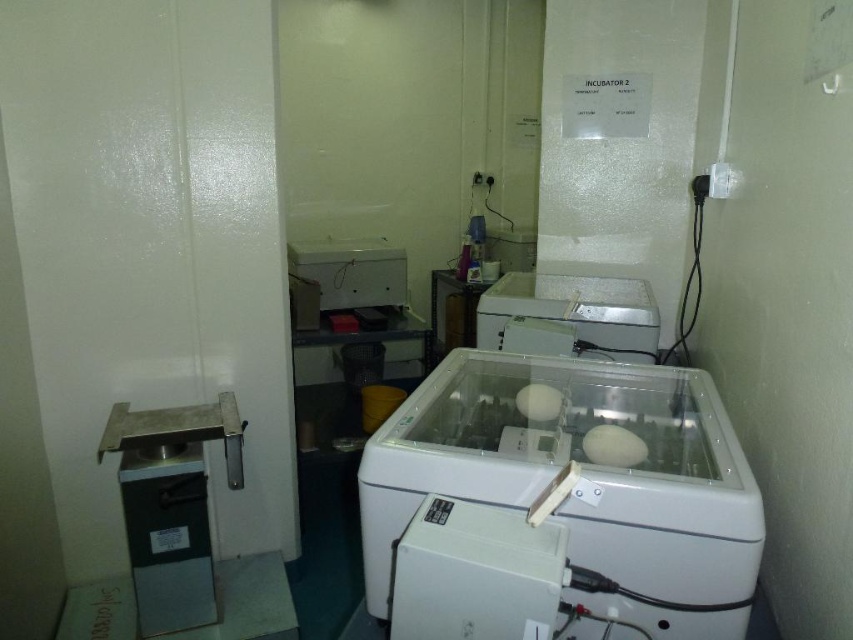
From the picture: Is transparent plastic incubator at center to the left of white plastic incubator at center from the viewer's perspective?

Correct, you'll find transparent plastic incubator at center to the left of white plastic incubator at center.

Where is `transparent plastic incubator at center`? transparent plastic incubator at center is located at coordinates (560, 504).